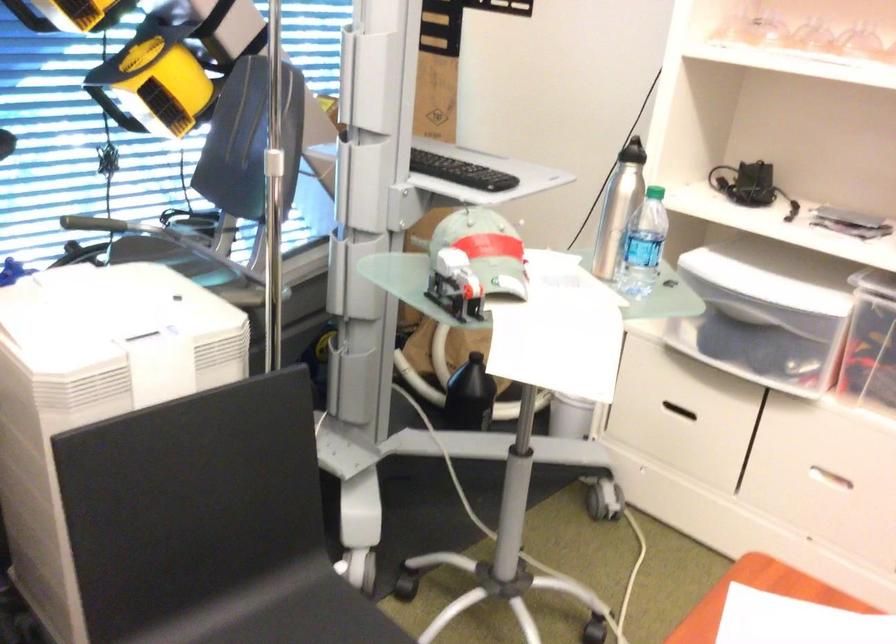
The image size is (896, 644). What do you see at coordinates (97, 223) in the screenshot?
I see `the black foam handle` at bounding box center [97, 223].